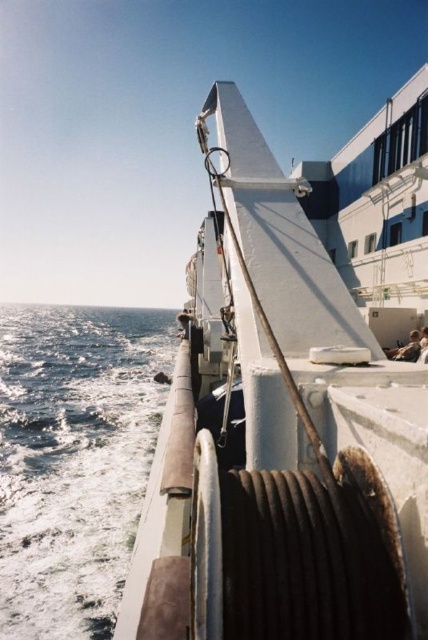
Is white matte boat at center to the left of blue water at lower left from the viewer's perspective?

In fact, white matte boat at center is to the right of blue water at lower left.

Is point (377, 403) in front of point (32, 445)?

That is True.

This screenshot has height=640, width=428. In order to click on white matte boat at center in this screenshot , I will do `click(281, 432)`.

You are a GUI agent. You are given a task and a screenshot of the screen. Output one action in this format:
    pyautogui.click(x=<x>, y=<y>)
    Task: Click on the white matte boat at center
    The image size is (428, 640).
    Given the screenshot: What is the action you would take?
    pyautogui.click(x=281, y=432)